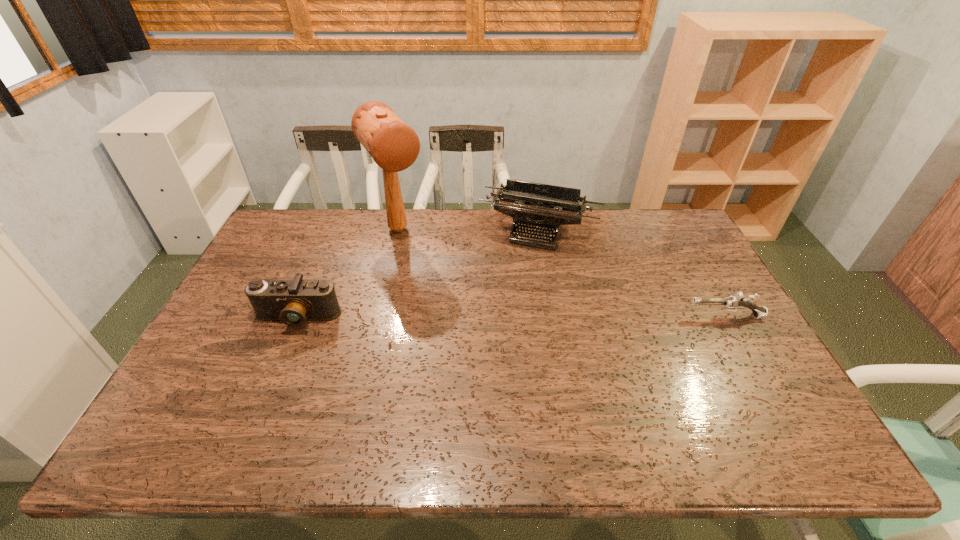
Find the location of a particular element. Image resolution: width=960 pixels, height=540 pixels. blank area located 0.070m on the typing side of the typewriter is located at coordinates (518, 264).

Locate an element on the screen. free space located 0.400m on the typing side of the typewriter is located at coordinates (491, 339).

Find the location of a particular element. The width and height of the screenshot is (960, 540). free space located 0.300m on the typing side of the typewriter is located at coordinates (500, 313).

The image size is (960, 540). In order to click on vacant space located on the strike surface of the mallet in this screenshot , I will do `click(432, 280)`.

At what (x,y) coordinates should I click in order to perform the action: click on vacant region located 0.150m on the strike surface of the mallet. Please return your answer as a coordinate pair (x, y). Looking at the image, I should click on (428, 274).

Find the location of a particular element. This screenshot has width=960, height=540. vacant space situated 0.390m on the strike surface of the mallet is located at coordinates (464, 324).

This screenshot has height=540, width=960. I want to click on typewriter at the far edge, so click(x=530, y=204).

Find the location of `mallet positioned at the far edge`. mallet positioned at the far edge is located at coordinates (394, 146).

The image size is (960, 540). Find the location of `object located in the left edge section of the desktop`. object located in the left edge section of the desktop is located at coordinates (292, 302).

The height and width of the screenshot is (540, 960). Identify the location of object that is at the right edge. (732, 303).